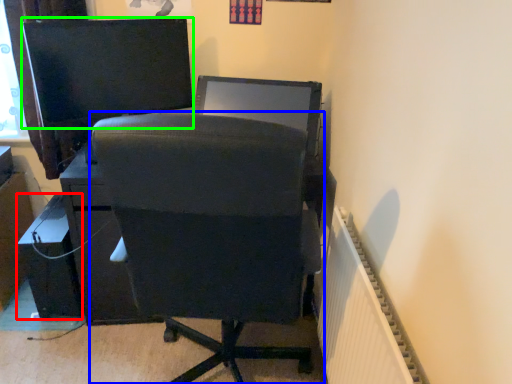
Question: Estimate the real-world distances between objects in this image. Which object is farther from furniture (highlighted by a red box), chair (highlighted by a blue box) or computer monitor (highlighted by a green box)?

Choices:
 (A) chair
 (B) computer monitor

Answer: (A)